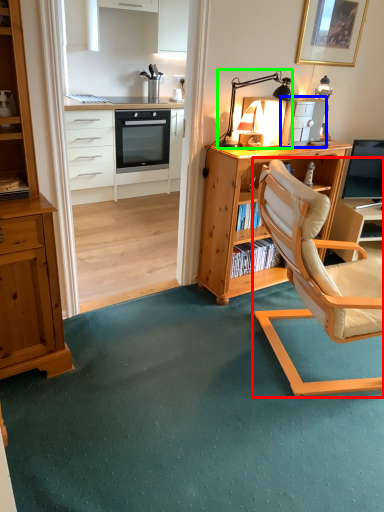
Question: Considering the real-world distances, which object is closest to chair (highlighted by a red box)? appliance (highlighted by a blue box) or table lamp (highlighted by a green box).

Choices:
 (A) appliance
 (B) table lamp

Answer: (A)